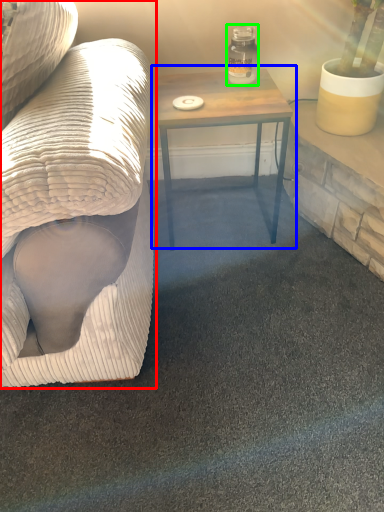
Question: Based on their relative distances, which object is nearer to studio couch (highlighted by a red box)? Choose from table (highlighted by a blue box) and glass jar (highlighted by a green box).

Choices:
 (A) table
 (B) glass jar

Answer: (A)